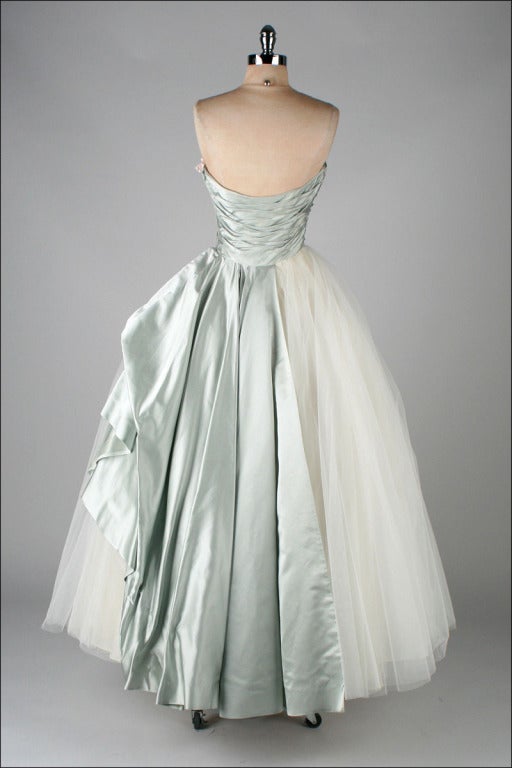
The height and width of the screenshot is (768, 512). Find the location of `mannequin on wheels`. mannequin on wheels is located at coordinates (198, 717), (314, 713).